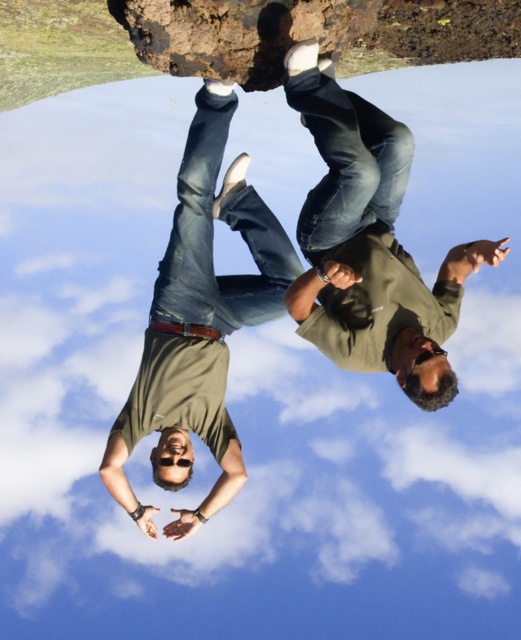
You are an observer looking at the scene. There are two shirts visible in the image, a green matte shirt at center and a matte khaki shirt at center. Which shirt is positioned closer to you?

The green matte shirt at center is closer to the viewer than the matte khaki shirt at center.

You are an artist trying to paint this scene. You want to ensure the green matte shirt at center and the matte khaki shirt at center are proportionate to each other. Based on the scene, which shirt should you paint smaller?

The green matte shirt at center should be painted smaller because it occupies less space than the matte khaki shirt at center according to the description.